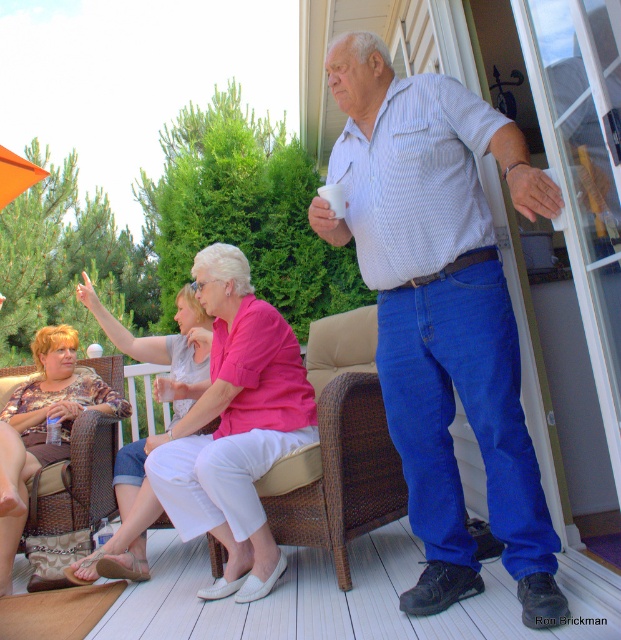
Is point (247, 310) positioned before point (34, 349)?

That is True.

Between pink fabric shirt at center and printed fabric dress at lower left, which one is positioned higher?

pink fabric shirt at center is higher up.

Who is more distant from viewer, (183, 509) or (0, 458)?

Point (0, 458)

Where is `pink fabric shirt at center`? The height and width of the screenshot is (640, 621). pink fabric shirt at center is located at coordinates (233, 426).

Who is positioned more to the left, woven brown chair at center or printed fabric dress at lower left?

Positioned to the left is printed fabric dress at lower left.

Which is above, woven brown chair at center or printed fabric dress at lower left?

printed fabric dress at lower left

You are a GUI agent. You are given a task and a screenshot of the screen. Output one action in this format:
    pyautogui.click(x=<x>, y=<y>)
    Task: Click on the woven brown chair at center
    The width and height of the screenshot is (621, 640).
    Given the screenshot: What is the action you would take?
    pyautogui.click(x=340, y=448)

Does point (6, 422) lie behind point (196, 372)?

No, it is not.

Who is more forward, (20, 477) or (143, 509)?

Point (143, 509) is more forward.

Is point (17, 429) behind point (119, 486)?

That is True.

You are a GUI agent. You are given a task and a screenshot of the screen. Output one action in this format:
    pyautogui.click(x=<x>, y=<y>)
    Task: Click on the printed fabric dress at lower left
    Image resolution: width=621 pixels, height=640 pixels.
    Given the screenshot: What is the action you would take?
    pyautogui.click(x=42, y=428)